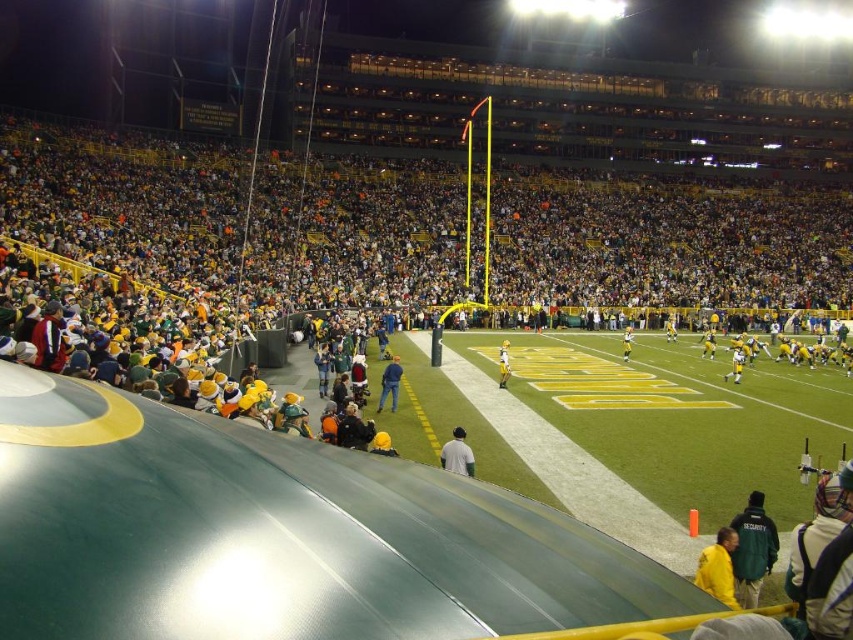
Between yellow matte jacket at lower right and blue jeans at center, which one has less height?

yellow matte jacket at lower right is shorter.

Which is more to the right, yellow matte jacket at lower right or blue jeans at center?

Positioned to the right is yellow matte jacket at lower right.

Find the location of `yellow matte jacket at lower right`. yellow matte jacket at lower right is located at coordinates [718, 566].

Is blue jeans at center bigger than yellow uniform at center?

Incorrect, blue jeans at center is not larger than yellow uniform at center.

Between blue jeans at center and yellow uniform at center, which one has more height?

Standing taller between the two is blue jeans at center.

Find the location of a particular element. This screenshot has height=640, width=853. blue jeans at center is located at coordinates (390, 384).

In order to click on blue jeans at center in this screenshot , I will do `click(390, 384)`.

Is blue jeans at center thinner than yellow matte helmet at center?

Yes, blue jeans at center is thinner than yellow matte helmet at center.

Between blue jeans at center and yellow matte helmet at center, which one has less height?

Standing shorter between the two is yellow matte helmet at center.

Locate an element on the screen. The width and height of the screenshot is (853, 640). blue jeans at center is located at coordinates (390, 384).

You are a GUI agent. You are given a task and a screenshot of the screen. Output one action in this format:
    pyautogui.click(x=<x>, y=<y>)
    Task: Click on the blue jeans at center
    
    Given the screenshot: What is the action you would take?
    pyautogui.click(x=390, y=384)